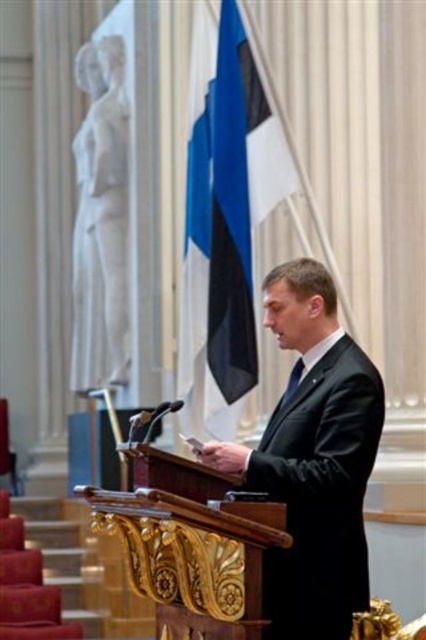
Between black glossy suit at center and blue fabric flag at center, which one has less height?

black glossy suit at center

Is black glossy suit at center to the left of blue fabric flag at center from the viewer's perspective?

Incorrect, black glossy suit at center is not on the left side of blue fabric flag at center.

Is point (310, 365) behind point (242, 256)?

No, (310, 365) is closer to viewer.

This screenshot has width=426, height=640. What are the coordinates of `black glossy suit at center` in the screenshot? It's located at (313, 460).

Who is positioned more to the right, blue fabric flag at center or black satin tie at center?

From the viewer's perspective, black satin tie at center appears more on the right side.

Is point (236, 115) behind point (293, 378)?

Yes, point (236, 115) is behind point (293, 378).

You are a GUI agent. You are given a task and a screenshot of the screen. Output one action in this format:
    pyautogui.click(x=<x>, y=<y>)
    Task: Click on the blue fabric flag at center
    The width and height of the screenshot is (426, 640).
    Given the screenshot: What is the action you would take?
    pyautogui.click(x=230, y=241)

Is black glossy suit at center above black satin tie at center?

No, black glossy suit at center is not above black satin tie at center.

How much distance is there between black glossy suit at center and black satin tie at center?

black glossy suit at center is 2.64 meters from black satin tie at center.

The width and height of the screenshot is (426, 640). Describe the element at coordinates (313, 460) in the screenshot. I see `black glossy suit at center` at that location.

Locate an element on the screen. The width and height of the screenshot is (426, 640). black glossy suit at center is located at coordinates [313, 460].